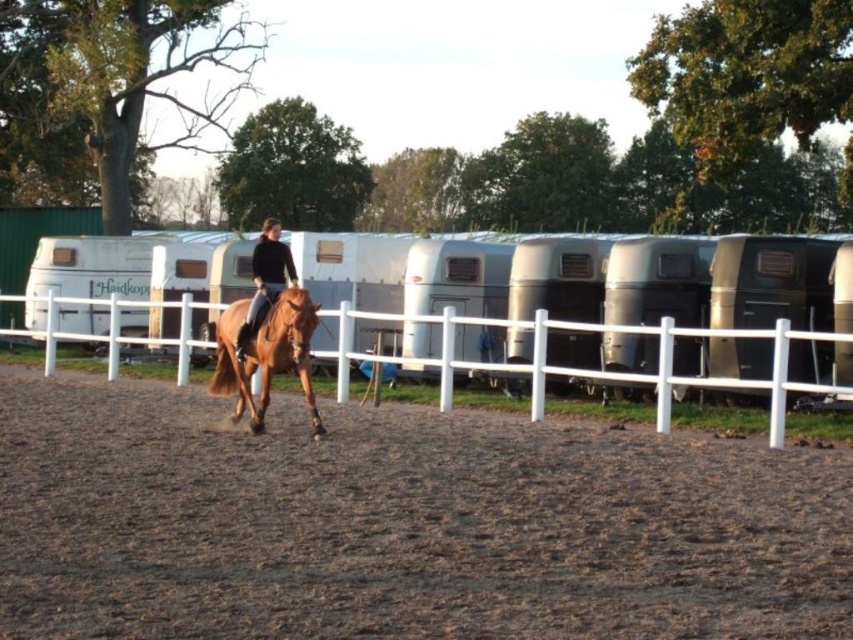
Based on the photo, is brown sandy dirt at center wider than matte brown horse at center?

Indeed, brown sandy dirt at center has a greater width compared to matte brown horse at center.

Does brown sandy dirt at center have a larger size compared to matte brown horse at center?

No.

Does point (833, 573) come behind point (251, 320)?

No, (833, 573) is in front of (251, 320).

The height and width of the screenshot is (640, 853). Find the location of `brown sandy dirt at center`. brown sandy dirt at center is located at coordinates click(x=401, y=524).

Which of these two, shiny brown horse at center or matte brown horse at center, stands taller?

With more height is matte brown horse at center.

Which is behind, point (241, 348) or point (282, 246)?

Positioned behind is point (282, 246).

I want to click on shiny brown horse at center, so click(265, 353).

Between point (114, 316) and point (247, 321), which one is positioned in front?

Point (247, 321)

Who is lower down, white plastic fence at center or matte brown horse at center?

white plastic fence at center is lower down.

Who is more forward, (743, 381) or (283, 257)?

Point (743, 381) is in front.

I want to click on white plastic fence at center, so click(x=637, y=374).